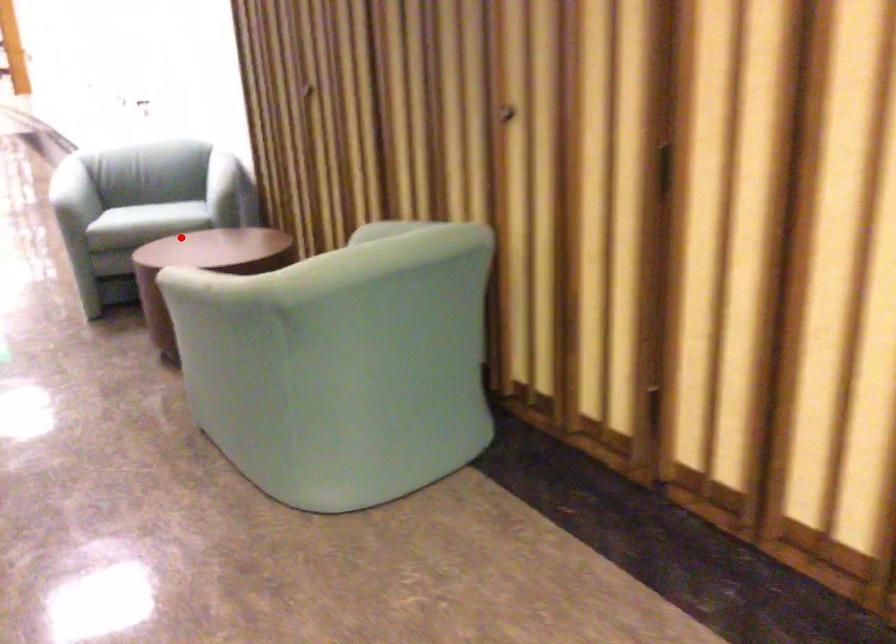
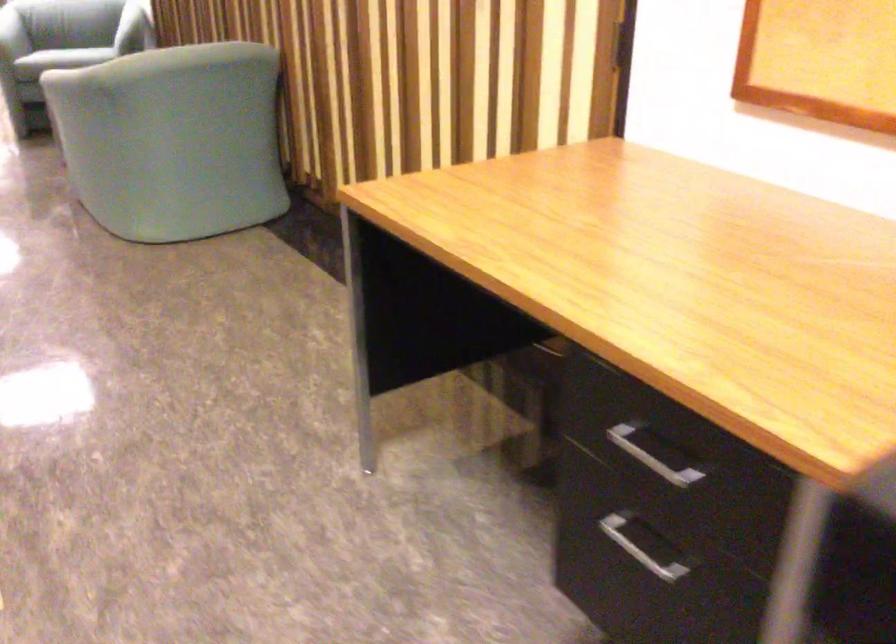
The point at the highlighted location is marked in the first image. Where is the corresponding point in the second image?

(66, 57)